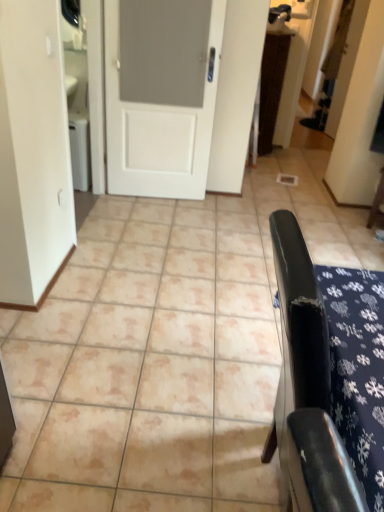
Question: Can you confirm if white matte door at center is smaller than black leather chair at right, the 1th furniture positioned from the front?

Choices:
 (A) yes
 (B) no

Answer: (A)

Question: From a real-world perspective, is white matte door at center on black leather chair at right, which appears as the 2th furniture when viewed from the back?

Choices:
 (A) no
 (B) yes

Answer: (B)

Question: Is white matte door at center thinner than black leather chair at right, the second furniture from the top?

Choices:
 (A) yes
 (B) no

Answer: (A)

Question: Considering the relative sizes of white matte door at center and black leather chair at right, the first furniture when ordered from bottom to top, in the image provided, is white matte door at center taller than black leather chair at right, the first furniture when ordered from bottom to top,?

Choices:
 (A) no
 (B) yes

Answer: (B)

Question: Does white matte door at center have a lesser height compared to black leather chair at right, the second furniture from the top?

Choices:
 (A) yes
 (B) no

Answer: (B)

Question: Is white matte door at center far away from black leather chair at right, the 1th furniture positioned from the front?

Choices:
 (A) yes
 (B) no

Answer: (A)

Question: From the image's perspective, is white matte door at center above wooden chair at right, the second furniture in the front-to-back sequence?

Choices:
 (A) yes
 (B) no

Answer: (A)

Question: Is white matte door at center oriented towards wooden chair at right, positioned as the second furniture in bottom-to-top order?

Choices:
 (A) yes
 (B) no

Answer: (B)

Question: From a real-world perspective, is white matte door at center positioned over wooden chair at right, positioned as the second furniture in bottom-to-top order, based on gravity?

Choices:
 (A) yes
 (B) no

Answer: (A)

Question: Can you confirm if white matte door at center is thinner than wooden chair at right, which is counted as the 1th furniture, starting from the right?

Choices:
 (A) no
 (B) yes

Answer: (B)

Question: Could wooden chair at right, which appears as the second furniture when viewed from the left, be considered to be inside white matte door at center?

Choices:
 (A) yes
 (B) no

Answer: (B)

Question: Is white matte door at center at the left side of wooden chair at right, positioned as the second furniture in bottom-to-top order?

Choices:
 (A) no
 (B) yes

Answer: (B)

Question: Does black leather chair at right, the 1th furniture positioned from the front, have a smaller size compared to wooden chair at right, which is counted as the 1th furniture, starting from the right?

Choices:
 (A) no
 (B) yes

Answer: (A)